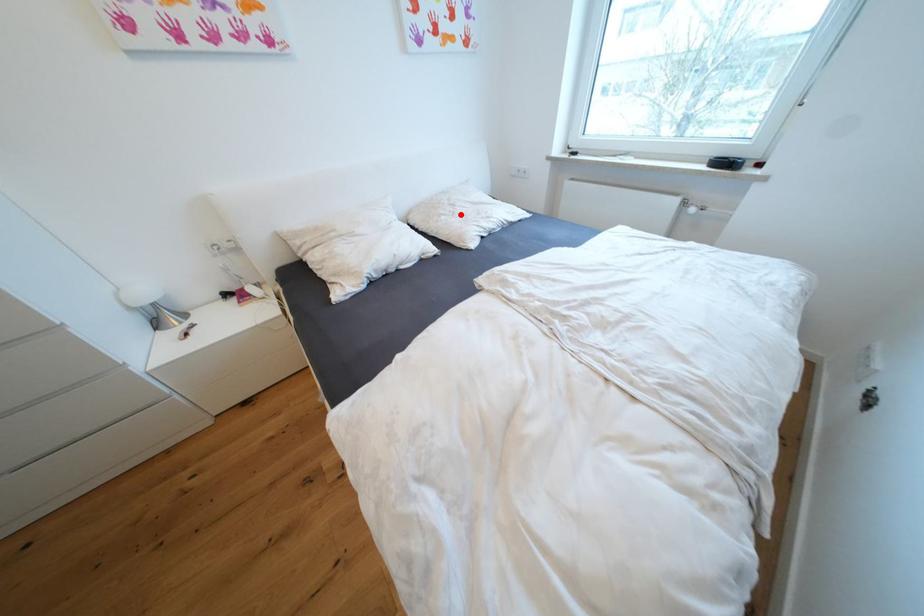
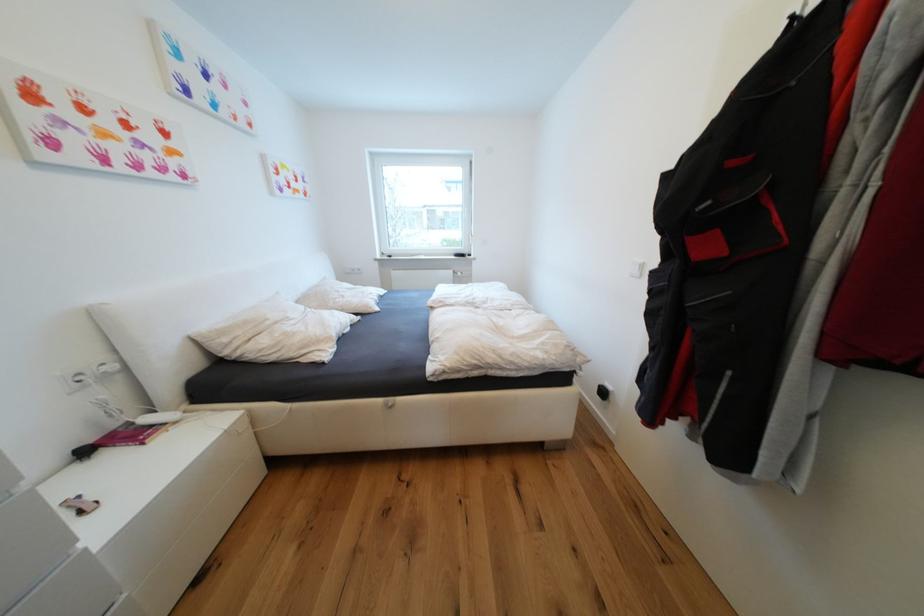
Locate, in the second image, the point that corresponds to the highlighted location in the first image.

(349, 297)